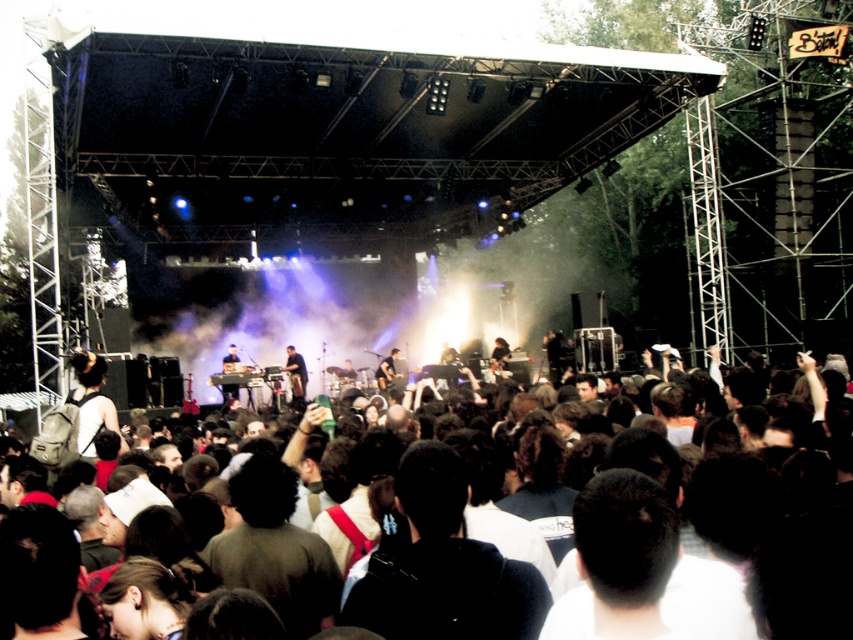
Question: Which object is positioned closest to the dark clothing at center?

Choices:
 (A) metallic keyboard at center
 (B) dark brown leather guitar at center
 (C) dark brown hair at center

Answer: (A)

Question: Can you confirm if metallic keyboard at center is positioned above dark brown leather guitar at center?

Choices:
 (A) yes
 (B) no

Answer: (A)

Question: Which object appears farthest from the camera in this image?

Choices:
 (A) metallic keyboard at center
 (B) dark brown leather guitar at center

Answer: (B)

Question: Can you confirm if dark clothing at center is thinner than metallic keyboard at center?

Choices:
 (A) no
 (B) yes

Answer: (B)

Question: Which is farther from the metallic keyboard at center?

Choices:
 (A) dark brown leather guitar at center
 (B) dark brown hair at center

Answer: (B)

Question: Is dark brown hair at center closer to camera compared to dark brown leather guitar at center?

Choices:
 (A) yes
 (B) no

Answer: (A)